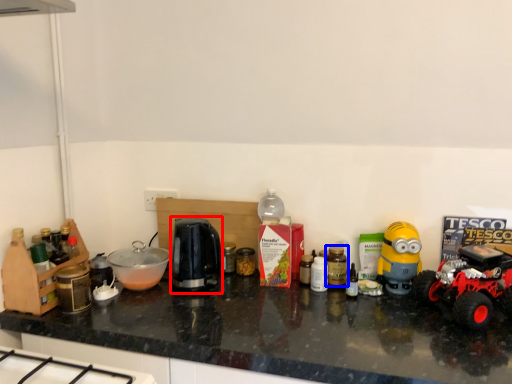
Question: Which of the following is the closest to the observer, coffee machine (highlighted by a red box) or bottle (highlighted by a blue box)?

Choices:
 (A) coffee machine
 (B) bottle

Answer: (A)